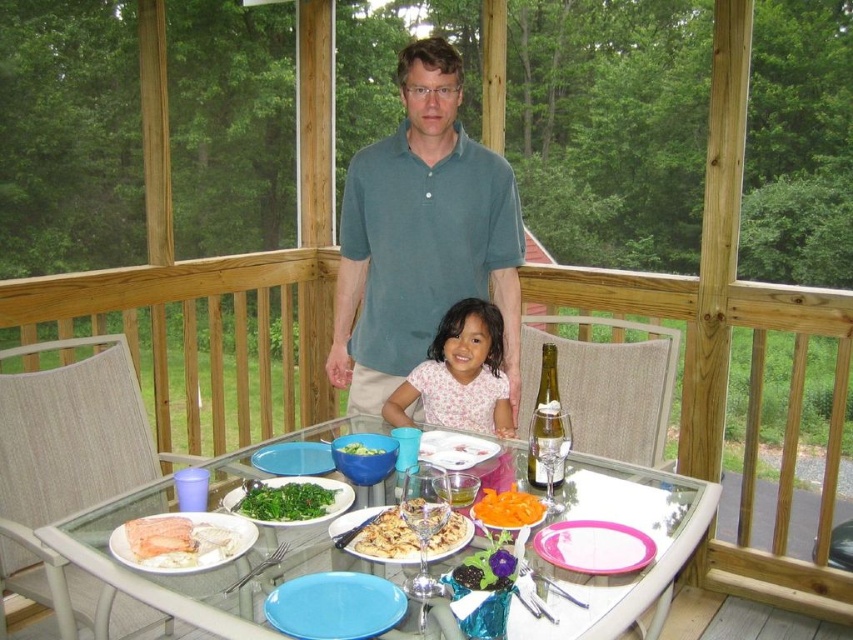
Question: Which point is closer to the camera?

Choices:
 (A) pink floral shirt at center
 (B) transparent glass table at center

Answer: (B)

Question: Observing the image, what is the correct spatial positioning of green leafy vegetable at center in reference to green leafy vegetables at center?

Choices:
 (A) below
 (B) above

Answer: (A)

Question: Which point appears farthest from the camera in this image?

Choices:
 (A) (535, 548)
 (B) (427, 177)

Answer: (B)

Question: Among these points, which one is nearest to the camera?

Choices:
 (A) (267, 451)
 (B) (445, 433)
 (C) (532, 516)
 (D) (595, 570)

Answer: (D)

Question: Is transparent glass table at center bigger than green leafy vegetables at center?

Choices:
 (A) yes
 (B) no

Answer: (A)

Question: Is green leafy vegetable at center smaller than blue plastic plate at center?

Choices:
 (A) yes
 (B) no

Answer: (A)